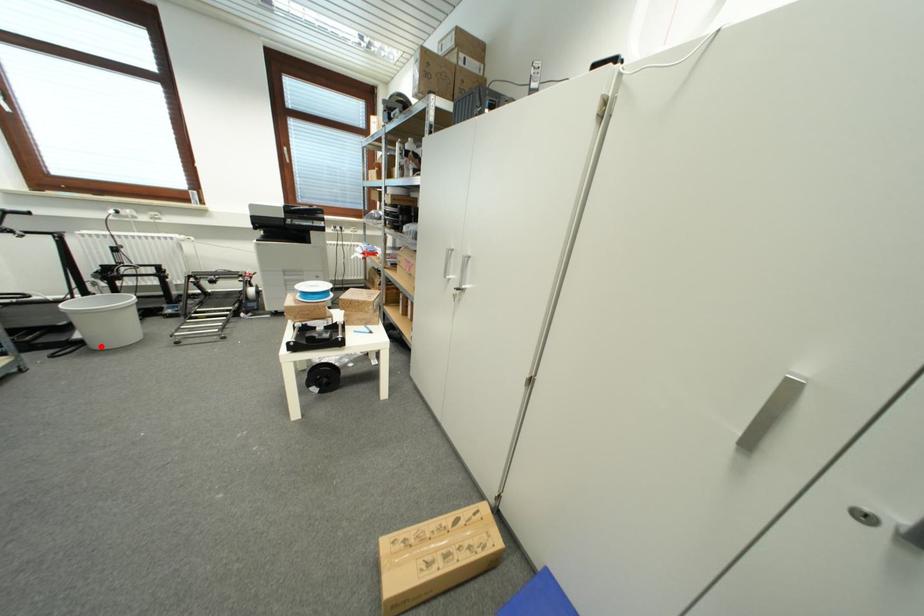
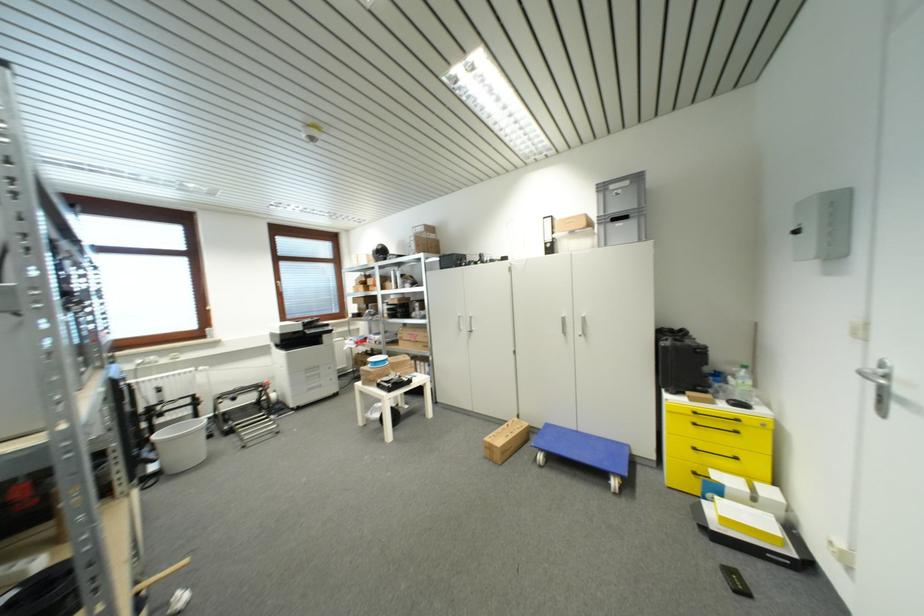
Question: I am providing you with two images of the same scene from different viewpoints. Given a red point in image1, look at the same physical point in image2. Is it:

Choices:
 (A) Closer to the viewpoint
 (B) Farther from the viewpoint

Answer: (B)